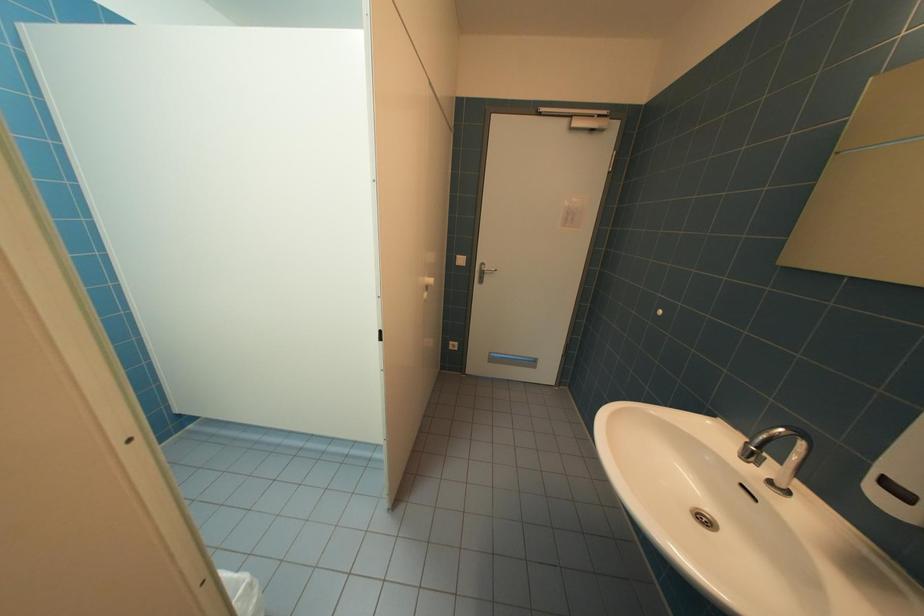
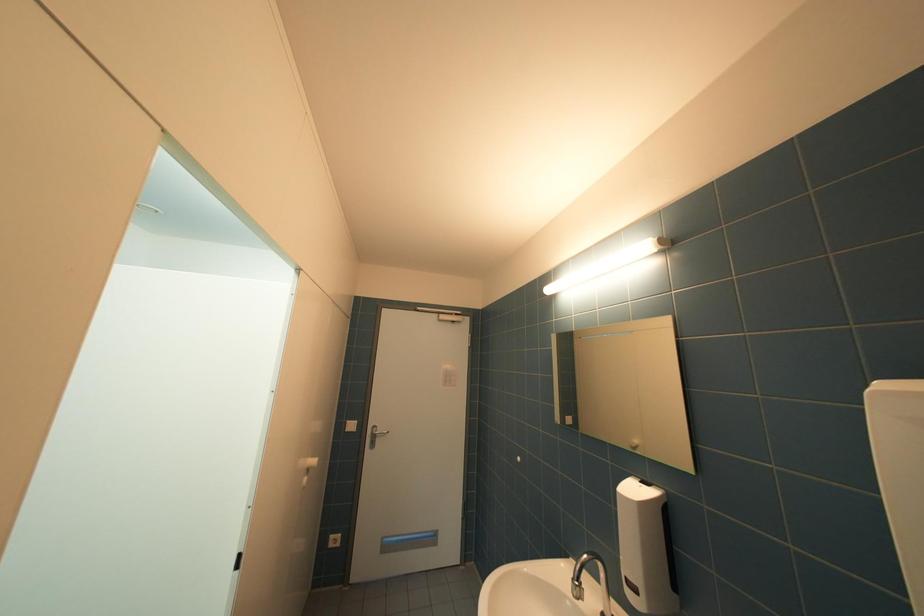
The images are taken continuously from a first-person perspective. In which direction is your viewpoint rotating?

The camera rotated toward right-up.